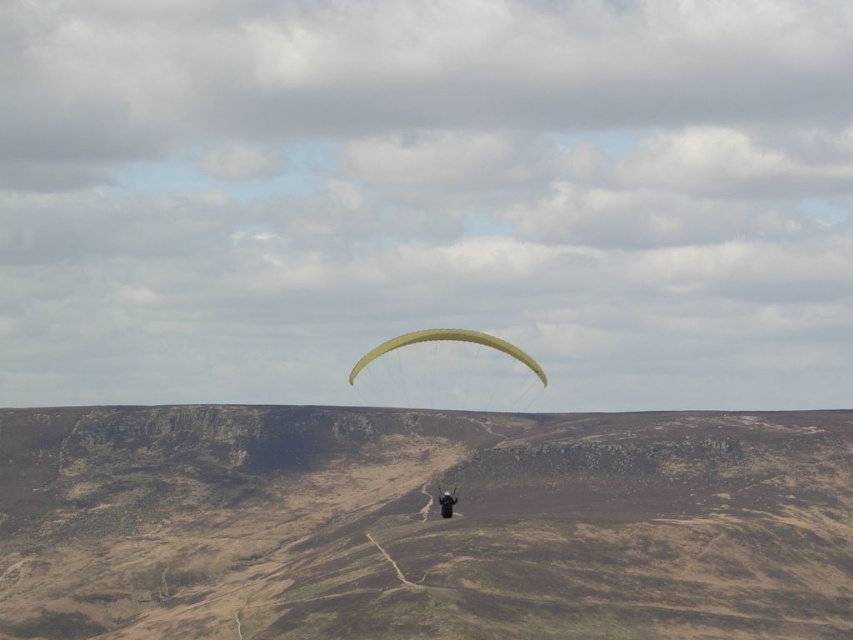
You are a drone operator planning to capture aerial footage of the brown textured hillside at center and the yellow fabric parachute at center. The drone has a maximum range of 70 meters. Can you fly the drone from the hillside to the parachute without exceeding its range?

The brown textured hillside at center is 72.99 meters away from the yellow fabric parachute at center. Since the distance exceeds the drone maximum range of 70 meters, the drone cannot fly from the hillside to the parachute without exceeding its range.

You are a drone operator trying to capture the paraglider in the image. You are currently at a point 889.23 feet away from the point at coordinates point (422, 330). Can you estimate whether you are closer to or farther from the paraglider than the camera?

The point (422, 330) is 889.23 feet away from the camera. Since you are at a point 889.23 feet away from the same point, you are at the same distance as the camera. Therefore, you are neither closer nor farther from the paraglider than the camera.